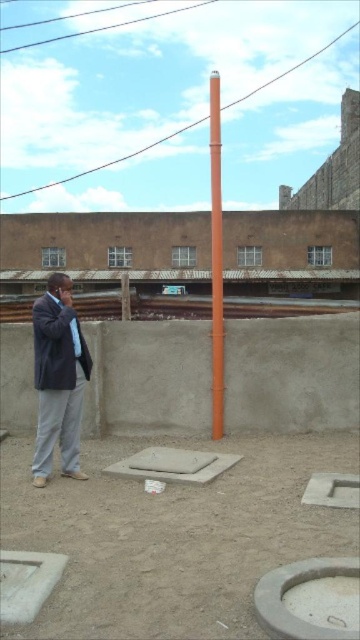
You are a painter who needs to place a ladder against the orange matte pole at center and the gray concrete manhole at center. Which object requires a taller ladder to reach its top?

The orange matte pole at center requires a taller ladder to reach its top because it is much taller than the gray concrete manhole at center.

You are standing at point (263, 586) and want to walk to the beige wall in the background. Is the point (36, 369) between you and the beige wall?

Point (36, 369) is behind point (263, 586), so it is not between you and the beige wall. You can walk towards the beige wall without obstacles in your path.